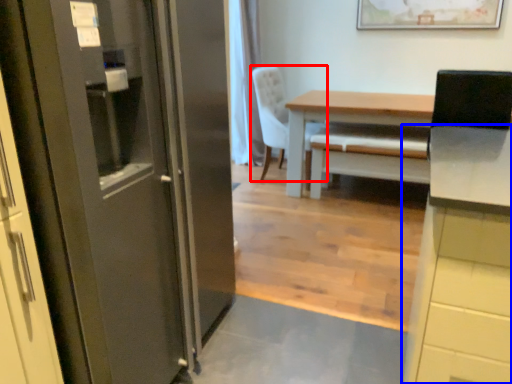
Question: Which object appears closest to the camera in this image, chair (highlighted by a red box) or cabinetry (highlighted by a blue box)?

Choices:
 (A) chair
 (B) cabinetry

Answer: (B)